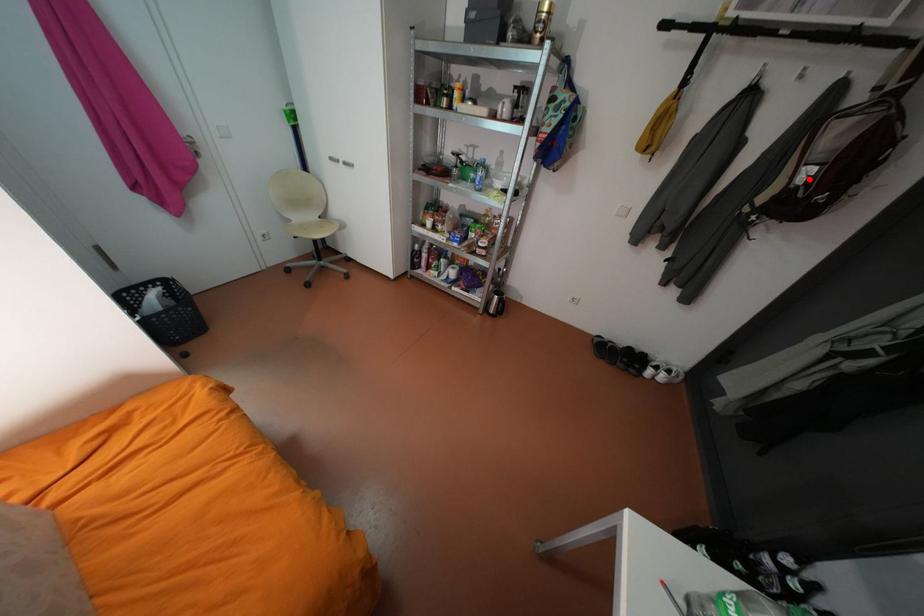
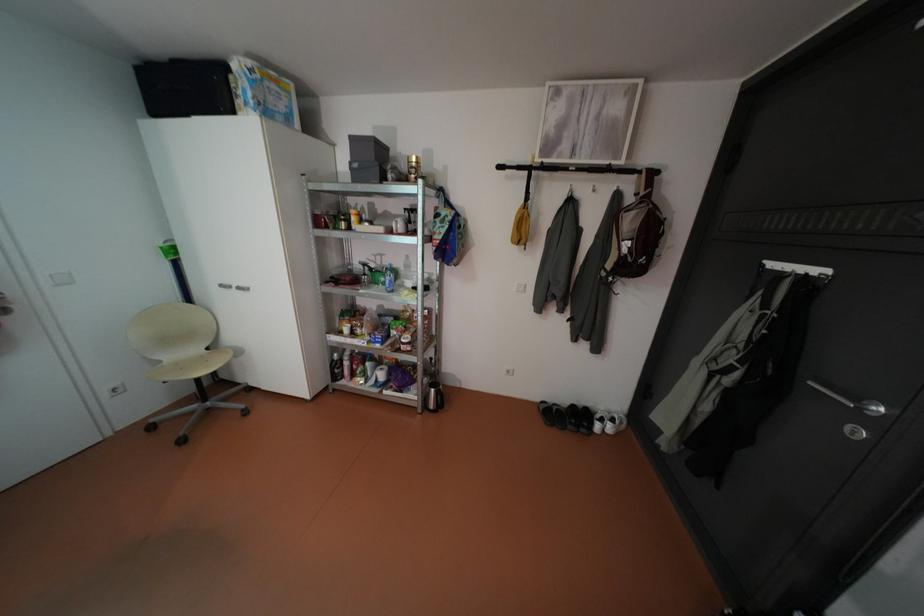
Question: I am providing you with two images of the same scene from different viewpoints. A red point is shown in image1. For the corresponding object point in image2, is it positioned nearer or farther from the camera?

Choices:
 (A) Nearer
 (B) Farther

Answer: (A)